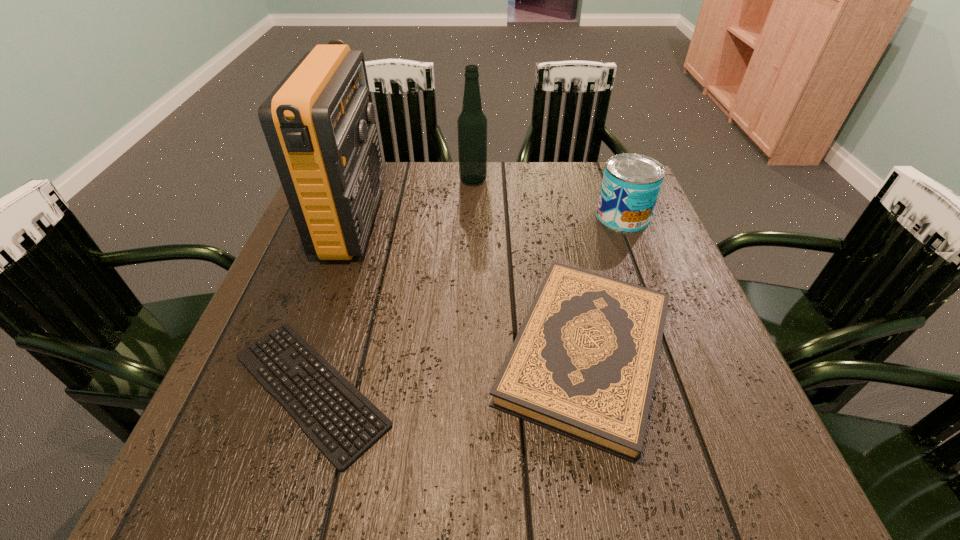
Find the location of a particular element. the tallest object is located at coordinates (318, 122).

Where is `the fourth shortest object`? The image size is (960, 540). the fourth shortest object is located at coordinates (472, 123).

The width and height of the screenshot is (960, 540). In order to click on the third tallest object in this screenshot , I will do `click(631, 183)`.

Locate an element on the screen. hardback book is located at coordinates (583, 364).

Locate an element on the screen. Image resolution: width=960 pixels, height=540 pixels. the shortest object is located at coordinates (284, 360).

Locate an element on the screen. This screenshot has height=540, width=960. free space located on the front-facing side of the tallest object is located at coordinates point(495,221).

The height and width of the screenshot is (540, 960). I want to click on vacant area located on the right of the fourth shortest object, so click(508, 180).

Find the location of a particular element. This screenshot has height=540, width=960. vacant point located 0.050m on the back of the can is located at coordinates (612, 191).

This screenshot has width=960, height=540. Find the location of `free space located on the left of the hardback book`. free space located on the left of the hardback book is located at coordinates (291, 353).

At what (x,y) coordinates should I click in order to perform the action: click on vacant space located on the right of the shortest object. Please return your answer as a coordinate pair (x, y). Looking at the image, I should click on (478, 389).